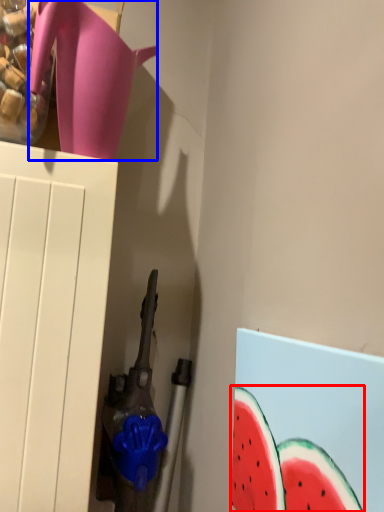
Question: Which object appears closest to the camera in this image, watermelon (highlighted by a red box) or jug (highlighted by a blue box)?

Choices:
 (A) watermelon
 (B) jug

Answer: (A)